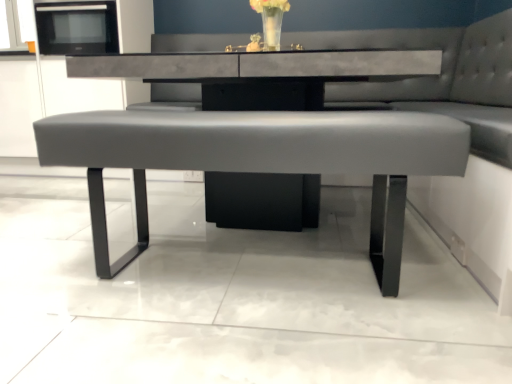
Question: From a real-world perspective, is matte gray bench at center located higher than black matte microwave at upper left?

Choices:
 (A) yes
 (B) no

Answer: (B)

Question: Is matte gray bench at center shorter than black matte microwave at upper left?

Choices:
 (A) no
 (B) yes

Answer: (A)

Question: From a real-world perspective, is matte gray bench at center under black matte microwave at upper left?

Choices:
 (A) yes
 (B) no

Answer: (A)

Question: Is matte gray bench at center not inside black matte microwave at upper left?

Choices:
 (A) no
 (B) yes

Answer: (B)

Question: From the image's perspective, is matte gray bench at center on top of black matte microwave at upper left?

Choices:
 (A) no
 (B) yes

Answer: (A)

Question: In the image, is translucent glass vase at upper center positioned in front of or behind matte gray bench at center?

Choices:
 (A) behind
 (B) front

Answer: (A)

Question: Considering the positions of translucent glass vase at upper center and matte gray bench at center in the image, is translucent glass vase at upper center bigger or smaller than matte gray bench at center?

Choices:
 (A) big
 (B) small

Answer: (B)

Question: Is point (269, 48) closer or farther from the camera than point (395, 230)?

Choices:
 (A) farther
 (B) closer

Answer: (A)

Question: From the image's perspective, is translucent glass vase at upper center above or below matte gray bench at center?

Choices:
 (A) above
 (B) below

Answer: (A)

Question: In the image, is matte gray bench at center positioned in front of or behind black matte microwave at upper left?

Choices:
 (A) front
 (B) behind

Answer: (A)

Question: Considering the positions of matte gray bench at center and black matte microwave at upper left in the image, is matte gray bench at center wider or thinner than black matte microwave at upper left?

Choices:
 (A) wide
 (B) thin

Answer: (A)

Question: Is matte gray bench at center inside or outside of black matte microwave at upper left?

Choices:
 (A) outside
 (B) inside

Answer: (A)

Question: From a real-world perspective, is matte gray bench at center positioned above or below black matte microwave at upper left?

Choices:
 (A) below
 (B) above

Answer: (A)

Question: Is point (361, 168) positioned closer to the camera than point (278, 24)?

Choices:
 (A) closer
 (B) farther

Answer: (A)

Question: Considering the relative positions of matte gray bench at center and translucent glass vase at upper center in the image provided, is matte gray bench at center to the left or to the right of translucent glass vase at upper center?

Choices:
 (A) right
 (B) left

Answer: (B)